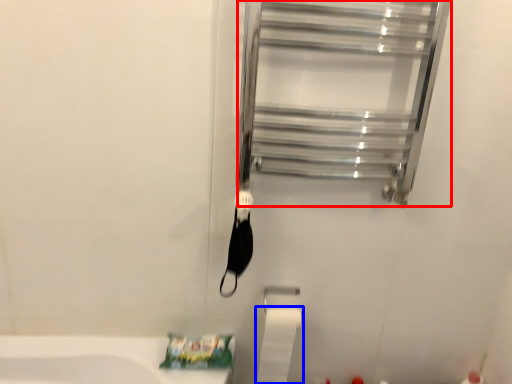
Question: Which object appears closest to the camera in this image, glass door (highlighted by a red box) or toilet paper (highlighted by a blue box)?

Choices:
 (A) glass door
 (B) toilet paper

Answer: (A)